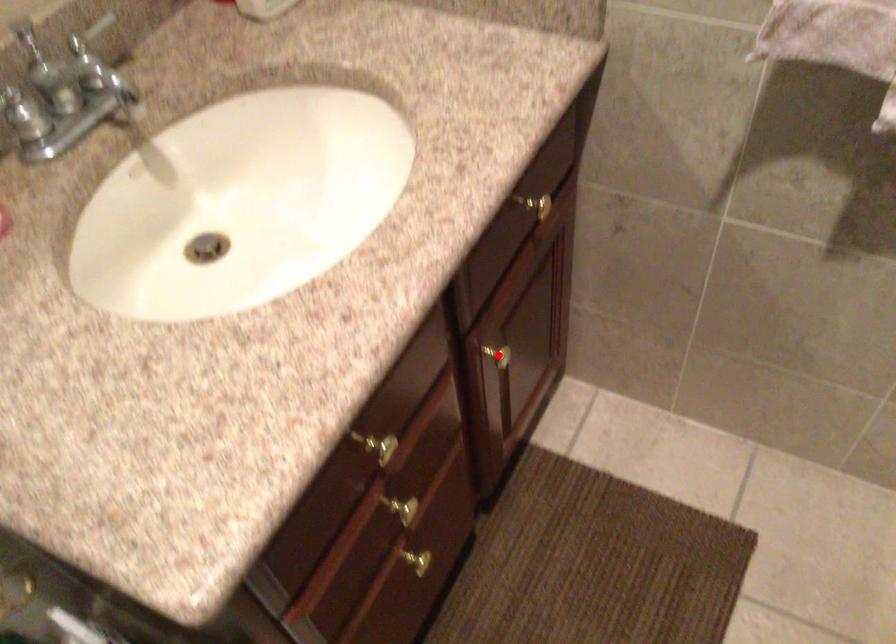
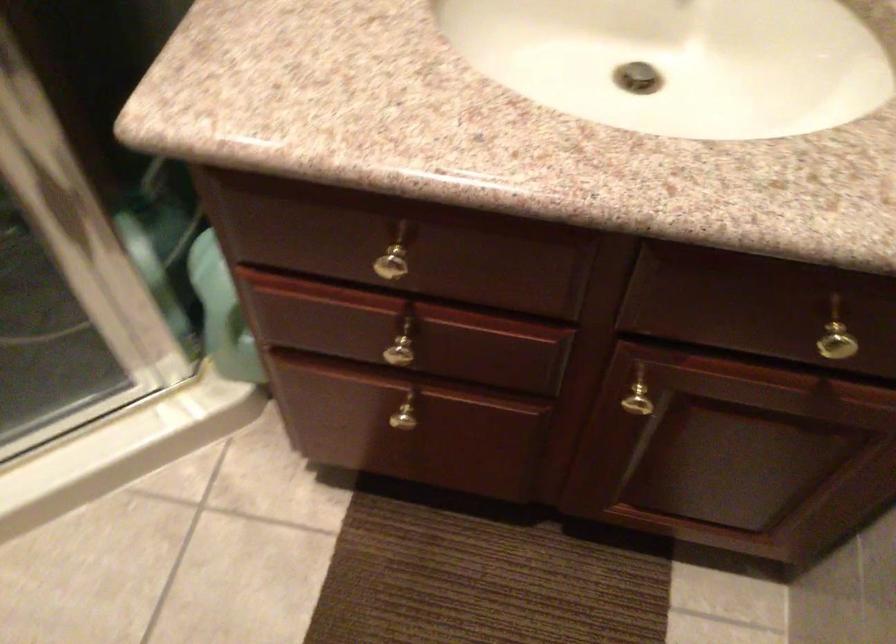
Question: A red point is marked in image1. In image2, is the corresponding 3D point closer to the camera or farther? Reply with the corresponding letter.

Choices:
 (A) The corresponding 3D point is closer.
 (B) The corresponding 3D point is farther.

Answer: (A)